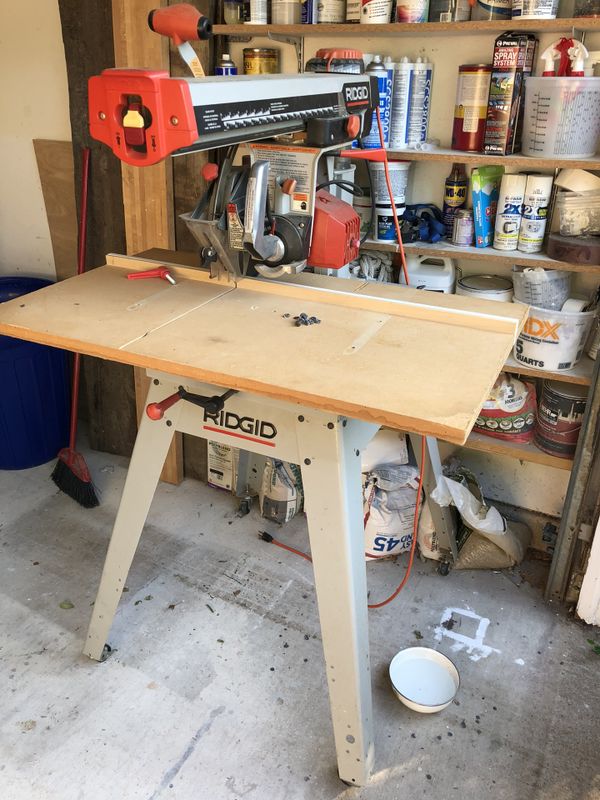
At what (x,y) coordinates should I click in order to perform the action: click on trash can. Please return your answer as a coordinate pair (x, y). The width and height of the screenshot is (600, 800). Looking at the image, I should click on (27, 404).